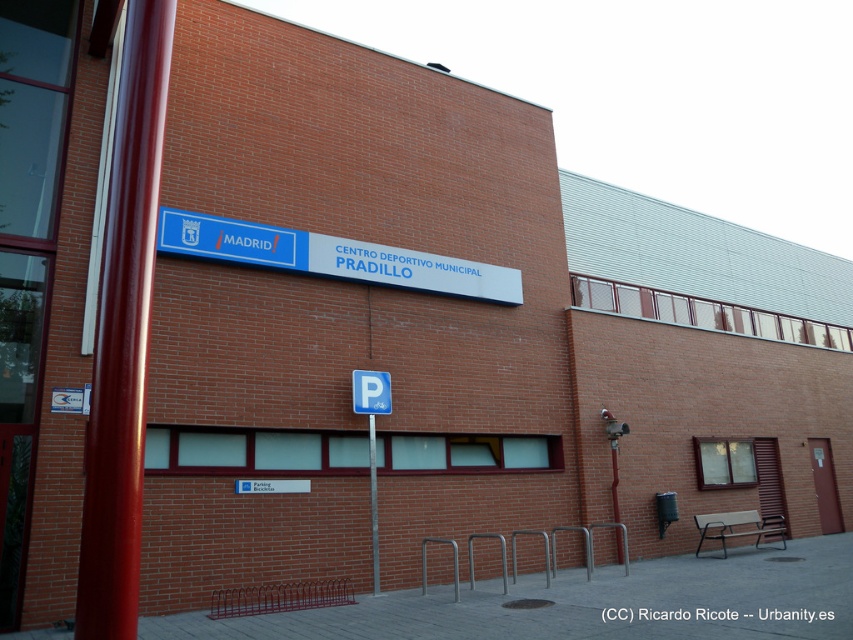
Question: Is blue plastic parking sign at lower center below metallic pole at center?

Choices:
 (A) no
 (B) yes

Answer: (A)

Question: Which of the following is the farthest from the observer?

Choices:
 (A) metallic pole at center
 (B) blue plastic sign at center
 (C) blue plastic parking sign at lower center

Answer: (C)

Question: Is the position of blue plastic sign at center more distant than that of blue plastic parking sign at lower center?

Choices:
 (A) no
 (B) yes

Answer: (A)

Question: Does blue plastic sign at center appear on the right side of blue plastic parking sign at lower center?

Choices:
 (A) yes
 (B) no

Answer: (B)

Question: Which object is closer to the camera taking this photo?

Choices:
 (A) blue plastic sign at center
 (B) blue plastic parking sign at lower center
 (C) metallic pole at center

Answer: (A)

Question: Which point is closer to the camera?

Choices:
 (A) blue plastic parking sign at lower center
 (B) metallic pole at center

Answer: (B)